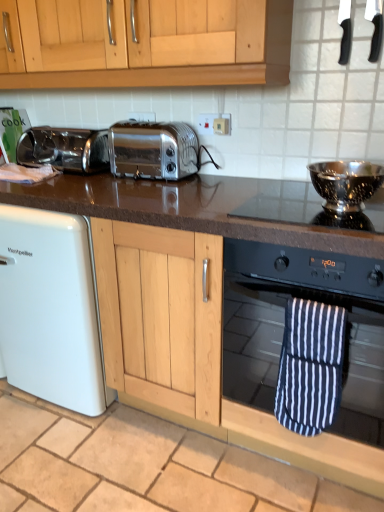
Question: Does white matte dishwasher at lower left have a greater height compared to black plastic knife at upper right, the first appliance from the top?

Choices:
 (A) no
 (B) yes

Answer: (B)

Question: Is white matte dishwasher at lower left wider than black plastic knife at upper right, the first appliance from the top?

Choices:
 (A) no
 (B) yes

Answer: (B)

Question: Is white matte dishwasher at lower left placed right next to black plastic knife at upper right, the first appliance from the top?

Choices:
 (A) yes
 (B) no

Answer: (B)

Question: Is the position of white matte dishwasher at lower left more distant than that of black plastic knife at upper right, the first appliance from the top?

Choices:
 (A) yes
 (B) no

Answer: (A)

Question: From a real-world perspective, is white matte dishwasher at lower left under black plastic knife at upper right, the first appliance from the top?

Choices:
 (A) no
 (B) yes

Answer: (B)

Question: Is white matte dishwasher at lower left looking in the opposite direction of black plastic knife at upper right, the first appliance from the top?

Choices:
 (A) no
 (B) yes

Answer: (A)

Question: Can you confirm if satin chrome toaster at center, the first toaster positioned from the right, is shorter than satin chrome toaster at center, marked as the second toaster in a right-to-left arrangement?

Choices:
 (A) yes
 (B) no

Answer: (B)

Question: From a real-world perspective, is satin chrome toaster at center, the first toaster positioned from the right, located higher than satin chrome toaster at center, the 1th toaster viewed from the left?

Choices:
 (A) yes
 (B) no

Answer: (A)

Question: Does satin chrome toaster at center, the first toaster positioned from the right, appear on the right side of satin chrome toaster at center, marked as the second toaster in a right-to-left arrangement?

Choices:
 (A) no
 (B) yes

Answer: (B)

Question: Is satin chrome toaster at center, the 2th toaster in the left-to-right sequence, bigger than satin chrome toaster at center, marked as the second toaster in a right-to-left arrangement?

Choices:
 (A) no
 (B) yes

Answer: (B)

Question: Is satin chrome toaster at center, the first toaster positioned from the right, taller than satin chrome toaster at center, marked as the second toaster in a right-to-left arrangement?

Choices:
 (A) no
 (B) yes

Answer: (B)

Question: Is satin chrome toaster at center, the 2th toaster in the left-to-right sequence, located outside satin chrome toaster at center, the 1th toaster viewed from the left?

Choices:
 (A) yes
 (B) no

Answer: (A)

Question: From a real-world perspective, does black granite countertop at center stand above satin chrome toaster at center, the 2th toaster in the left-to-right sequence?

Choices:
 (A) no
 (B) yes

Answer: (A)